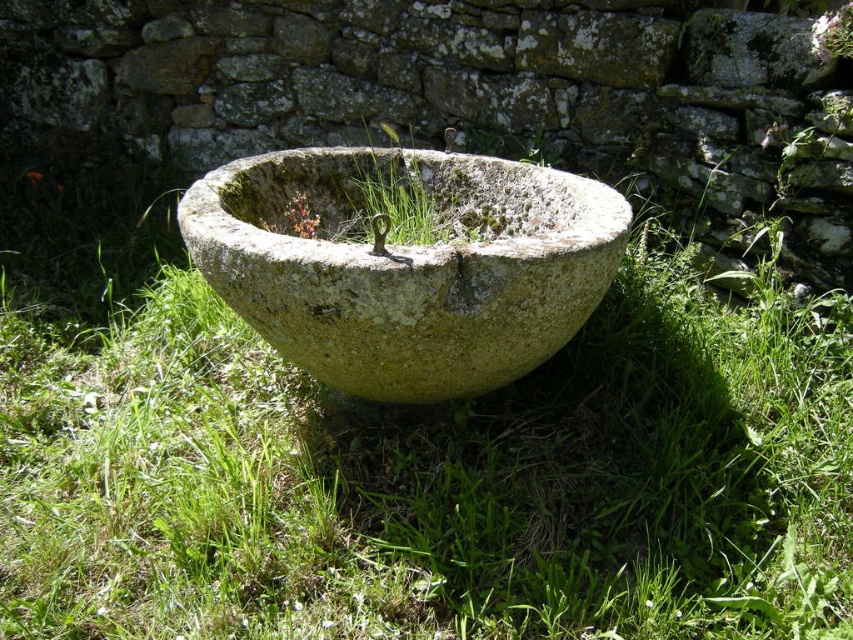
Is point (259, 292) farther from viewer compared to point (368, 170)?

No, it is in front of (368, 170).

Describe the element at coordinates (407, 266) in the screenshot. I see `green mossy stone bowl at center` at that location.

Measure the distance between point (326, 170) and camera.

Point (326, 170) and camera are 2.51 meters apart from each other.

The image size is (853, 640). What are the coordinates of `green mossy stone bowl at center` in the screenshot? It's located at (407, 266).